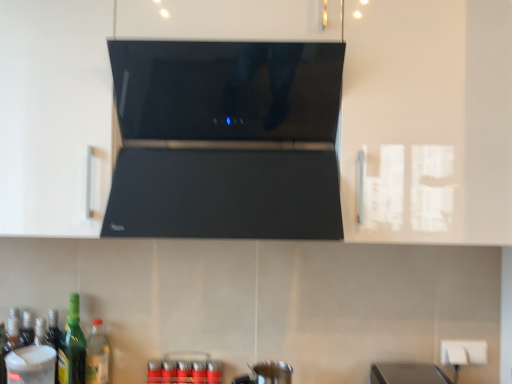
Question: Is black glossy range hood at center to the left or to the right of green glass bottle at lower left, the third bottle from the left, in the image?

Choices:
 (A) right
 (B) left

Answer: (A)

Question: Considering their positions, is black glossy range hood at center located in front of or behind green glass bottle at lower left, the 1th bottle viewed from the right?

Choices:
 (A) behind
 (B) front

Answer: (B)

Question: Estimate the real-world distances between objects in this image. Which object is closer to the transparent plastic container at lower left, the first appliance positioned from the left?

Choices:
 (A) matte black range hood at center
 (B) metallic silver can at lower center
 (C) white plastic electric outlet at lower right
 (D) green glass bottle at lower left, which ranks as the third bottle in right-to-left order
 (E) green glass bottle at lower left, placed as the second bottle when sorted from left to right

Answer: (D)

Question: Which object is the closest to the green glass bottle at lower left, the 1th bottle viewed from the right?

Choices:
 (A) matte black range hood at center
 (B) metallic silver pot at lower center, which is the 1th appliance from right to left
 (C) black glossy range hood at center
 (D) green glass bottle at lower left, which appears as the second bottle when viewed from the right
 (E) green glass bottle at lower left, which ranks as the third bottle in right-to-left order

Answer: (D)